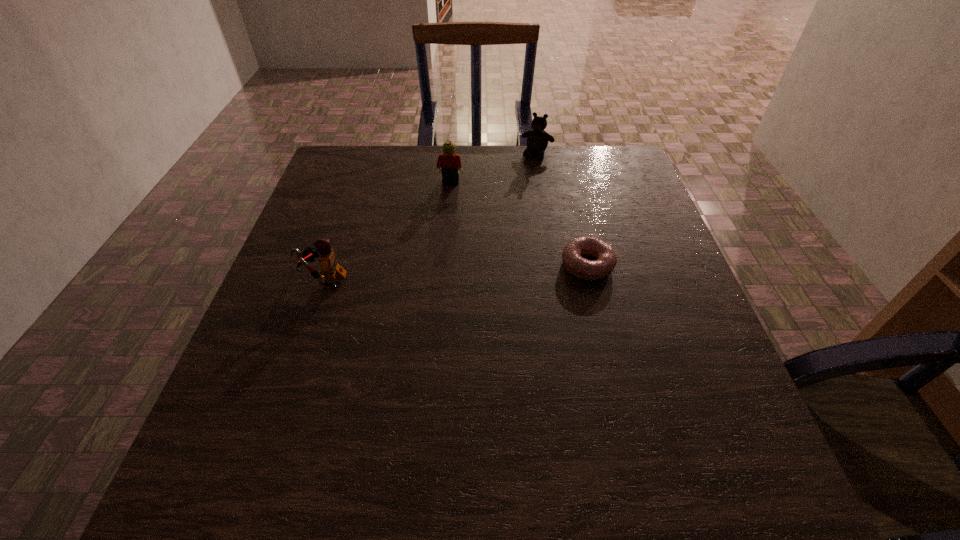
This screenshot has width=960, height=540. Find the location of `vacant space at the right edge of the desktop`. vacant space at the right edge of the desktop is located at coordinates (724, 367).

In the image, there is a desktop. What are the coordinates of `vacant space at the near left corner` in the screenshot? It's located at (276, 422).

At what (x,y) coordinates should I click in order to perform the action: click on free location at the near right corner. Please return your answer as a coordinate pair (x, y). The width and height of the screenshot is (960, 540). Looking at the image, I should click on pos(697,438).

The height and width of the screenshot is (540, 960). I want to click on free space between the second object from left to right and the doughnut, so click(x=518, y=224).

Locate an element on the screen. vacant area that lies between the left Lego and the shortest object is located at coordinates (455, 272).

Locate an element on the screen. vacant space that is in between the leftmost object and the farthest object is located at coordinates (430, 217).

Find the location of a particular element. The image size is (960, 540). free spot between the left Lego and the teddy bear is located at coordinates (430, 217).

At what (x,y) coordinates should I click in order to perform the action: click on empty space between the second object from left to right and the teddy bear. Please return your answer as a coordinate pair (x, y). Looking at the image, I should click on (493, 168).

At what (x,y) coordinates should I click in order to perform the action: click on vacant space that is in between the farther Lego and the left Lego. Please return your answer as a coordinate pair (x, y). Looking at the image, I should click on (387, 231).

The image size is (960, 540). Identify the location of vacant space that is in between the doughnut and the farthest object. (563, 210).